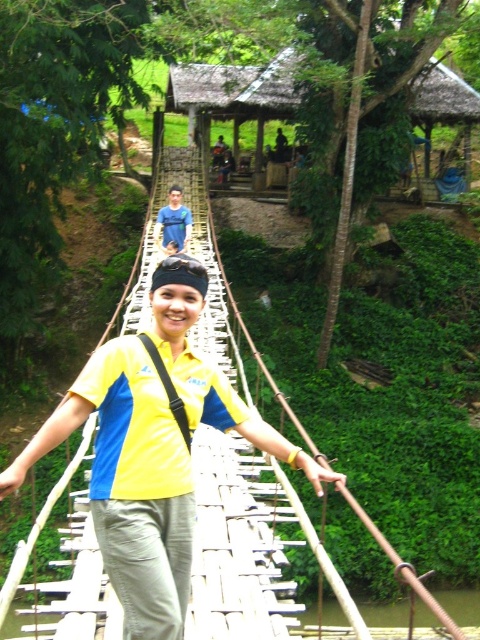
You are standing at the bottom right corner of the image and want to cross the brown wooden bridge at center. In which direction should you move to reach it?

You should move towards the center of the image to reach the brown wooden bridge at center, as it is located at point (462, 604).

You are a hiker standing on the brown wooden bridge at center and looking down at the blue denim jeans at center. Which object is taller?

The brown wooden bridge at center is taller than the blue denim jeans at center.

You are standing on the brown wooden bridge at center and want to walk towards the blue denim jeans at center. In which direction should you move?

The brown wooden bridge at center is to the right of blue denim jeans at center, so you should move to the left to walk towards the blue denim jeans at center.